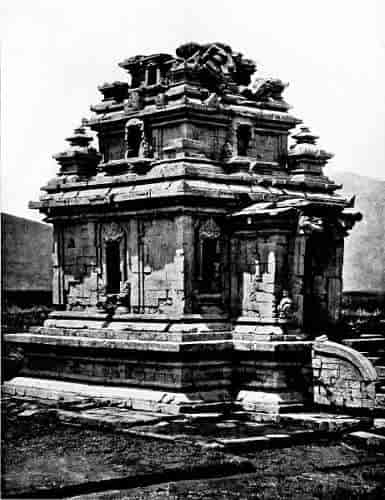
This screenshot has width=385, height=500. Find the location of `window.sill`. window.sill is located at coordinates (101, 294), (209, 294), (237, 152), (143, 83), (127, 151).